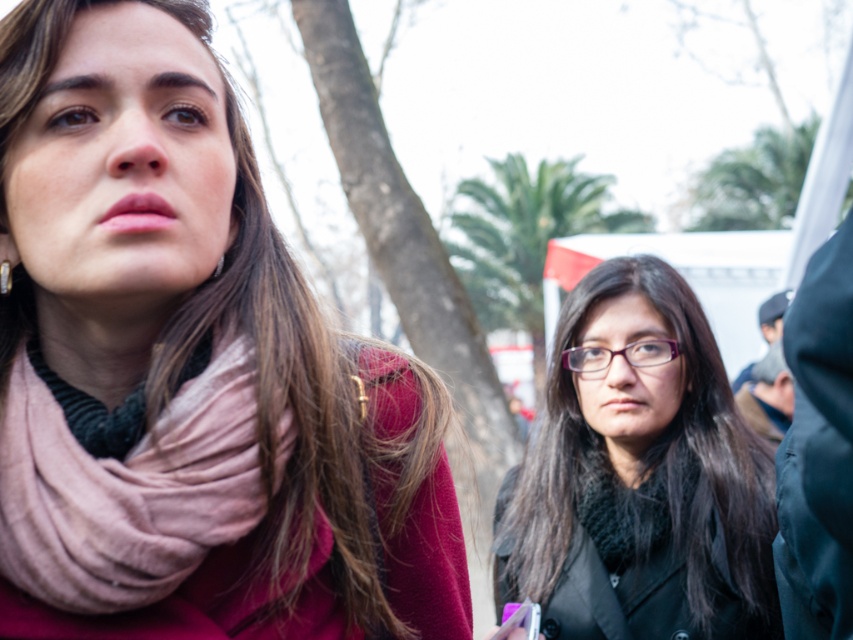
You are a photographer at the event and want to capture a photo that includes both the pink fabric scarf at upper left and the black matte glasses at center. Which object should you position higher in the frame to ensure both are visible?

To ensure both the pink fabric scarf at upper left and the black matte glasses at center are visible in the photo, position the pink fabric scarf at upper left higher in the frame since it is located above the black matte glasses at center.

You are a photographer at the event and want to capture a closeup of the pink fabric scarf at upper left. The camera you are using has a focus point at coordinate 0.578, 0.222. Will the scarf be in focus?

Yes, the pink fabric scarf at upper left is located at point (189, 369), so it will be in focus.